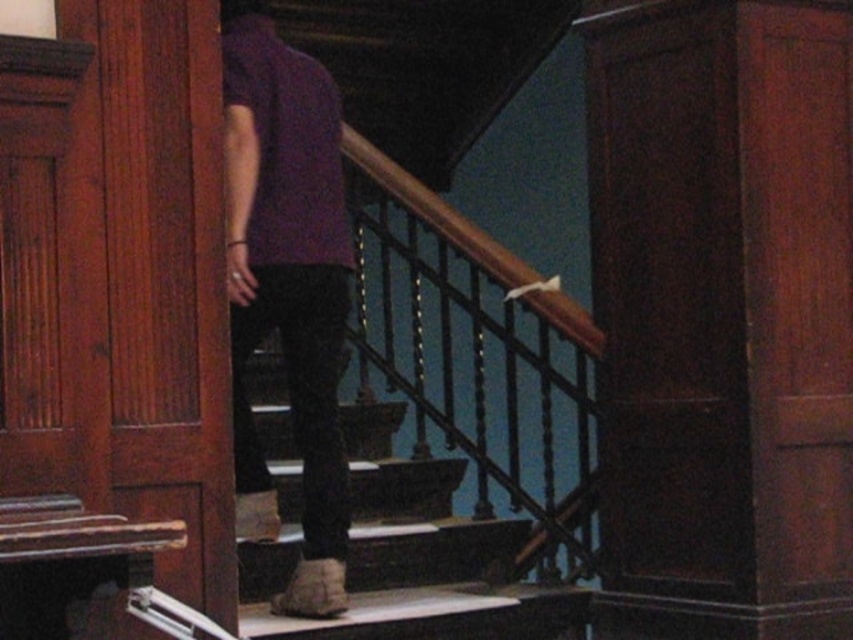
You are standing at the bottom of the staircase and want to reach the dark wood pillar at center. Which direction should you move to get closer to it without climbing the wooden stairs at center?

The dark wood pillar at center is closer to you than the wooden stairs at center, so you should move forward towards the dark wood pillar at center since it is in front of the stairs.

You are standing at the bottom of the staircase in the scene. You see two points marked on the wall. The first point is at coordinates point (250, 195) and the second is at point (494, 538). Which point is closer to you?

Point (250, 195) is in front of point (494, 538), so it is closer to you.